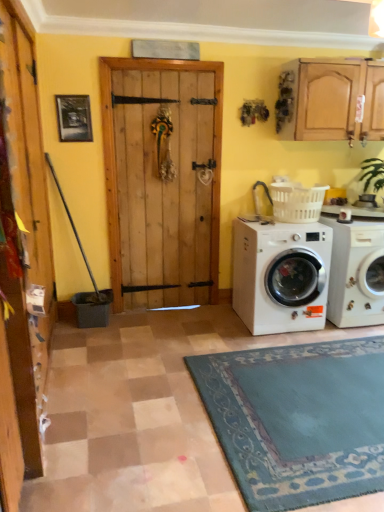
Question: Can you confirm if white plastic laundry basket at right is positioned to the left of wooden door at left?

Choices:
 (A) yes
 (B) no

Answer: (B)

Question: Would you consider white plastic laundry basket at right to be distant from wooden door at left?

Choices:
 (A) yes
 (B) no

Answer: (A)

Question: Is white plastic laundry basket at right positioned in front of wooden door at left?

Choices:
 (A) no
 (B) yes

Answer: (A)

Question: From a real-world perspective, is white plastic laundry basket at right on top of wooden door at left?

Choices:
 (A) yes
 (B) no

Answer: (B)

Question: Is white plastic laundry basket at right thinner than wooden door at left?

Choices:
 (A) no
 (B) yes

Answer: (A)

Question: Considering the relative positions of white plastic laundry basket at right and wooden door at left in the image provided, is white plastic laundry basket at right to the left or to the right of wooden door at left?

Choices:
 (A) left
 (B) right

Answer: (B)

Question: From the image's perspective, relative to wooden door at left, is white plastic laundry basket at right above or below?

Choices:
 (A) above
 (B) below

Answer: (A)

Question: Looking at their shapes, would you say white plastic laundry basket at right is wider or thinner than wooden door at left?

Choices:
 (A) wide
 (B) thin

Answer: (A)

Question: Is white plastic laundry basket at right bigger or smaller than wooden door at left?

Choices:
 (A) small
 (B) big

Answer: (B)

Question: From the image's perspective, is white glossy washing machine at lower right, the second washing machine when ordered from left to right, positioned above or below white matte washing machine at lower right, which is the second washing machine in right-to-left order?

Choices:
 (A) above
 (B) below

Answer: (A)

Question: From their relative heights in the image, would you say white glossy washing machine at lower right, which is the 1th washing machine in right-to-left order, is taller or shorter than white matte washing machine at lower right, marked as the 1th washing machine in a left-to-right arrangement?

Choices:
 (A) short
 (B) tall

Answer: (B)

Question: Is white glossy washing machine at lower right, which is the 1th washing machine in right-to-left order, inside the boundaries of white matte washing machine at lower right, which is the second washing machine in right-to-left order, or outside?

Choices:
 (A) outside
 (B) inside

Answer: (A)

Question: Is point (370, 306) closer or farther from the camera than point (281, 234)?

Choices:
 (A) closer
 (B) farther

Answer: (B)

Question: Considering the positions of point (309, 206) and point (380, 306), is point (309, 206) closer or farther from the camera than point (380, 306)?

Choices:
 (A) closer
 (B) farther

Answer: (A)

Question: Considering the relative positions of white plastic laundry basket at right and white glossy washing machine at lower right, which is the 1th washing machine in right-to-left order, in the image provided, is white plastic laundry basket at right to the left or to the right of white glossy washing machine at lower right, which is the 1th washing machine in right-to-left order,?

Choices:
 (A) right
 (B) left

Answer: (B)